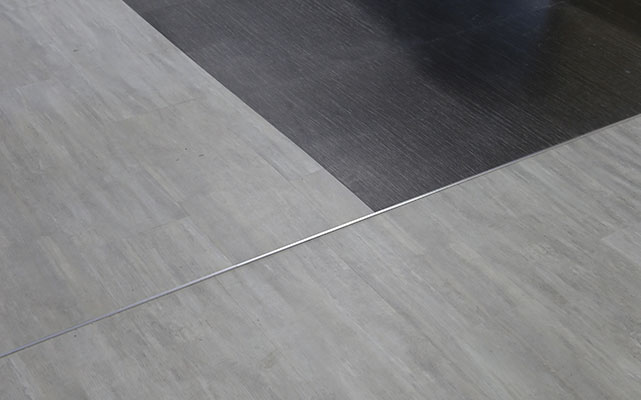
The image size is (641, 400). In order to click on dark brown laminate flooring in this screenshot , I will do `click(403, 127)`.